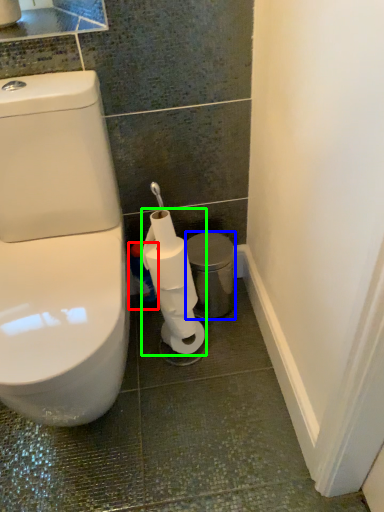
Question: Considering the real-world distances, which object is closest to cleaning product (highlighted by a red box)? porcelain (highlighted by a blue box) or toilet paper (highlighted by a green box).

Choices:
 (A) porcelain
 (B) toilet paper

Answer: (A)